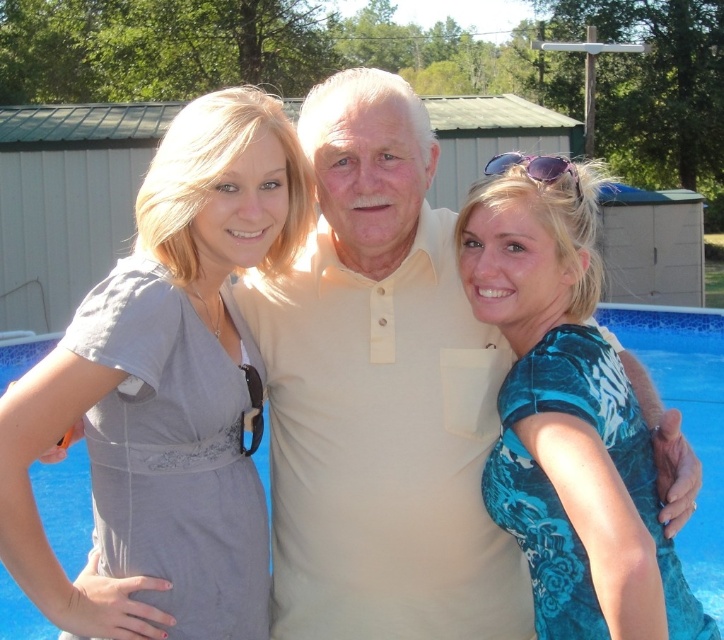
You are a photographer trying to capture the gray fabric dress at left and the blue floral dress at center. Which dress is covering part of the other?

The gray fabric dress at left is positioned over the blue floral dress at center, so it is covering part of the blue floral dress at center.

You are a photographer adjusting your camera settings. The gray fabric dress at left is in focus, but you want to ensure the entire group is sharp. Based on the scene, which part of the group might be slightly out of focus if the depth of field is limited?

The gray fabric dress at left is positioned at point (167, 385), so if the depth of field is limited, the edges of the group, particularly the rightmost person, might be slightly out of focus.